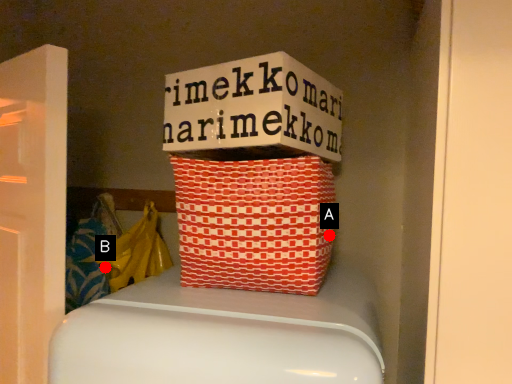
Question: Two points are circled on the image, labeled by A and B beside each circle. Which point is further to the camera?

Choices:
 (A) A is further
 (B) B is further

Answer: (B)